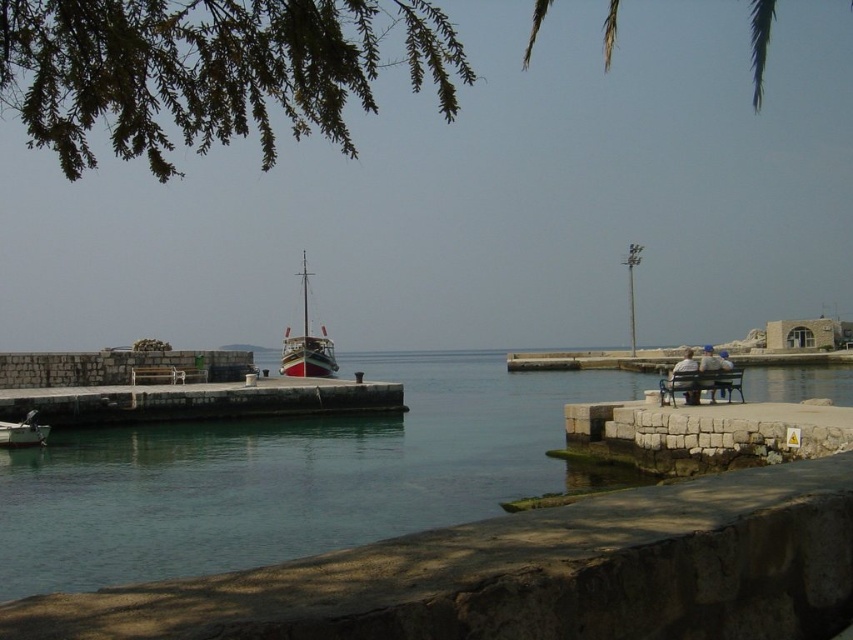
Question: Does wooden polished boat at center appear over blue denim jeans at lower right?

Choices:
 (A) yes
 (B) no

Answer: (A)

Question: Among these points, which one is nearest to the camera?

Choices:
 (A) coord(38,442)
 (B) coord(178,474)
 (C) coord(685,358)
 (D) coord(729,364)

Answer: (D)

Question: Which of the following is the closest to the observer?

Choices:
 (A) (712, 356)
 (B) (686, 397)
 (C) (155, 484)
 (D) (728, 371)

Answer: (C)

Question: Is green water at center positioned behind wooden bench at right?

Choices:
 (A) yes
 (B) no

Answer: (B)

Question: Does white wooden boat at left have a lesser width compared to light brown wooden bench at right?

Choices:
 (A) yes
 (B) no

Answer: (A)

Question: Which is nearer to the wooden bench at right?

Choices:
 (A) green water at center
 (B) blue denim jeans at lower right

Answer: (B)